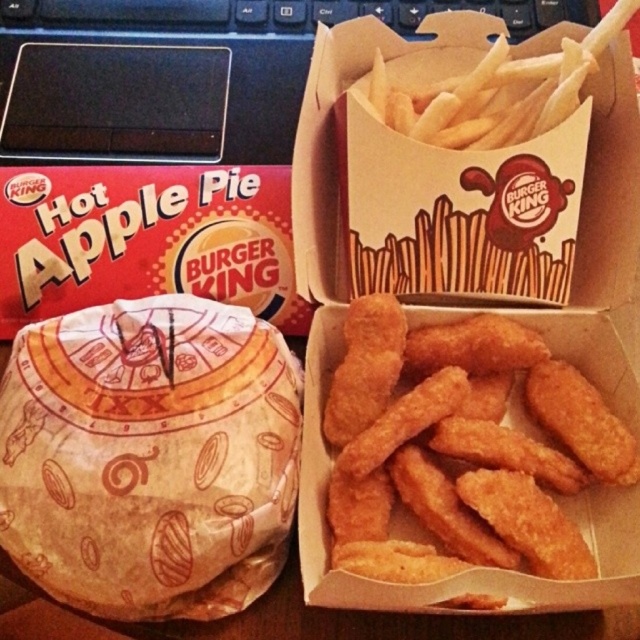
Question: Which object is positioned closest to the golden crispy french fries at upper center?

Choices:
 (A) golden crispy nuggets at center
 (B) black plastic laptop at upper left

Answer: (B)

Question: Is black plastic laptop at upper left closer to the viewer compared to golden crispy french fries at upper center?

Choices:
 (A) no
 (B) yes

Answer: (A)

Question: Which object is the closest to the black plastic laptop at upper left?

Choices:
 (A) golden crispy nuggets at center
 (B) golden crispy french fries at upper center

Answer: (B)

Question: Is golden crispy nuggets at center positioned behind black plastic laptop at upper left?

Choices:
 (A) no
 (B) yes

Answer: (A)

Question: Which of the following is the closest to the observer?

Choices:
 (A) (33, 48)
 (B) (493, 442)

Answer: (B)

Question: In this image, where is golden crispy nuggets at center located relative to golden crispy french fries at upper center?

Choices:
 (A) above
 (B) below

Answer: (B)